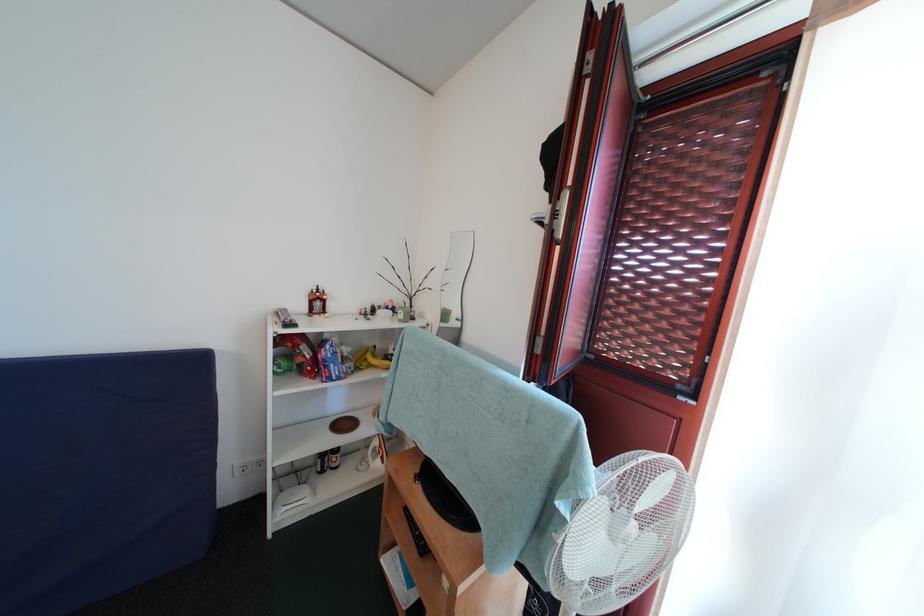
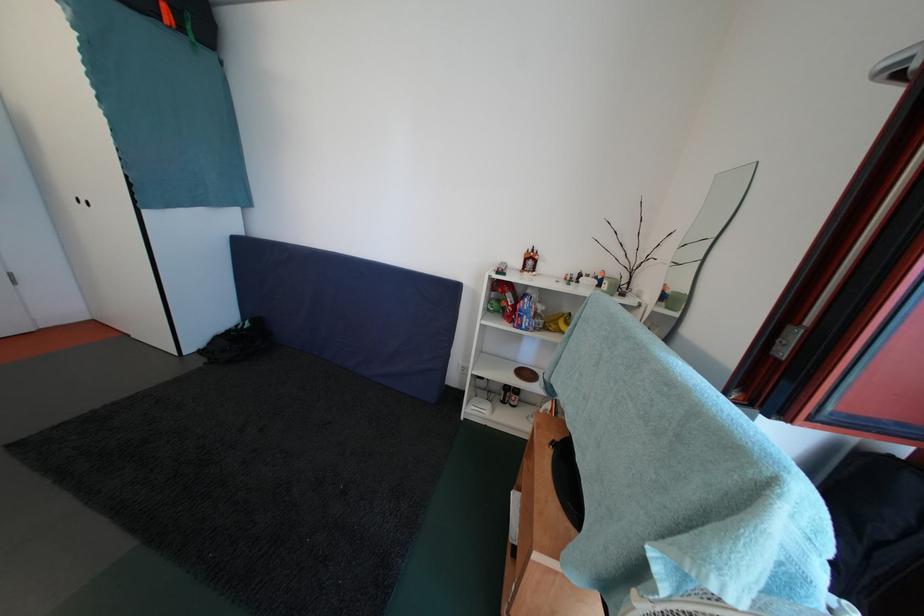
Question: Based on the continuous images, in which direction is the camera rotating? Reply with the corresponding letter.

Choices:
 (A) Left
 (B) Right
 (C) Up
 (D) Down

Answer: (A)